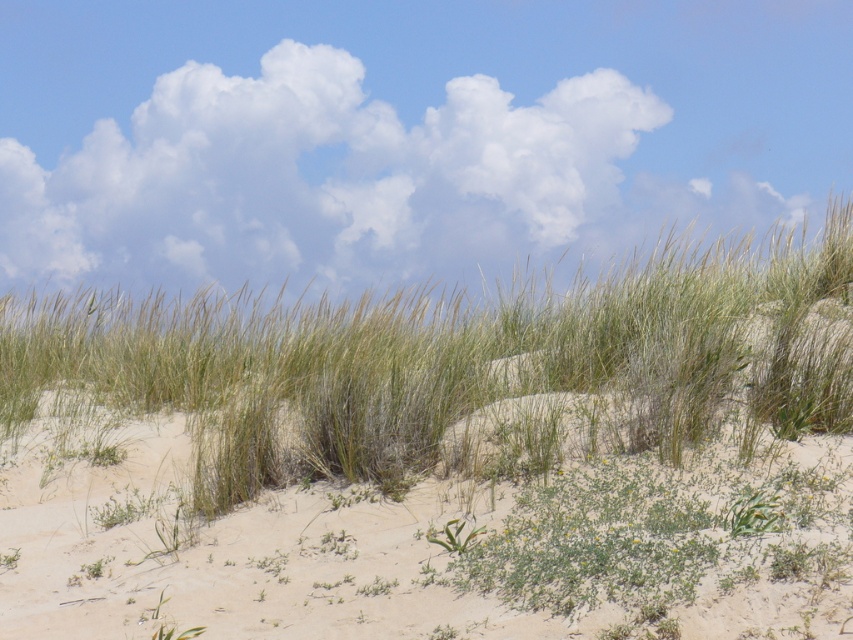
You are planning to take a photo of the green grass at center and white fluffy cloud at upper center. Which object is wider in the image?

The white fluffy cloud at upper center is wider than the green grass at center.

You are a photographer trying to capture the green grass at center and the white fluffy cloud at upper center in the same frame. Given that your camera has a maximum focal length that allows capturing objects within 3 meters of each other, can you achieve this?

The green grass at center is 3.70 meters away from the white fluffy cloud at upper center. Since the distance between them exceeds the camera maximum focal length of 3 meters, the photographer cannot capture both in the same frame.

You are a hiker navigating the sandy dune landscape. You see two points marked on your map. The first point is at coordinate point(581, 332) and the second point is at point(158, 216). If you are standing at the first point, which direction should you move to reach the second point?

Since point(581, 332) is in front of point(158, 216), you should move backward to reach the second point from the first point.